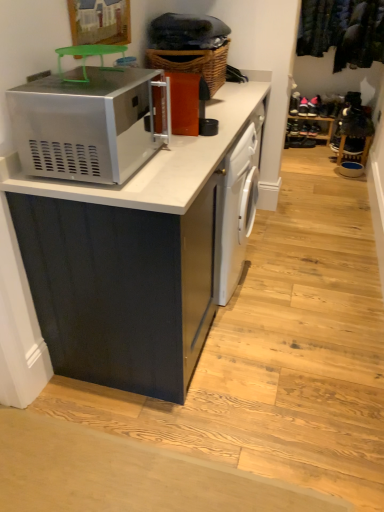
Question: Considering the relative sizes of white glossy dishwasher at center and wooden shoe rack at center in the image provided, is white glossy dishwasher at center thinner than wooden shoe rack at center?

Choices:
 (A) no
 (B) yes

Answer: (A)

Question: From a real-world perspective, is white glossy dishwasher at center located beneath wooden shoe rack at center?

Choices:
 (A) yes
 (B) no

Answer: (B)

Question: Considering the relative positions of white glossy dishwasher at center and wooden shoe rack at center in the image provided, is white glossy dishwasher at center in front of wooden shoe rack at center?

Choices:
 (A) yes
 (B) no

Answer: (A)

Question: From the image's perspective, is white glossy dishwasher at center beneath wooden shoe rack at center?

Choices:
 (A) no
 (B) yes

Answer: (B)

Question: Is wooden shoe rack at center surrounded by white glossy dishwasher at center?

Choices:
 (A) no
 (B) yes

Answer: (A)

Question: Is white glossy dishwasher at center positioned far away from wooden shoe rack at center?

Choices:
 (A) yes
 (B) no

Answer: (A)

Question: From a real-world perspective, is woven brown basket at upper center located higher than satin silver microwave at upper left?

Choices:
 (A) no
 (B) yes

Answer: (B)

Question: From a real-world perspective, is woven brown basket at upper center under satin silver microwave at upper left?

Choices:
 (A) no
 (B) yes

Answer: (A)

Question: Is woven brown basket at upper center smaller than satin silver microwave at upper left?

Choices:
 (A) no
 (B) yes

Answer: (A)

Question: Considering the relative sizes of woven brown basket at upper center and satin silver microwave at upper left in the image provided, is woven brown basket at upper center bigger than satin silver microwave at upper left?

Choices:
 (A) yes
 (B) no

Answer: (A)

Question: Is woven brown basket at upper center directly adjacent to satin silver microwave at upper left?

Choices:
 (A) no
 (B) yes

Answer: (A)

Question: Is woven brown basket at upper center shorter than satin silver microwave at upper left?

Choices:
 (A) no
 (B) yes

Answer: (A)

Question: Is dark green fabric at upper right positioned in front of woven brown basket at upper center?

Choices:
 (A) no
 (B) yes

Answer: (A)